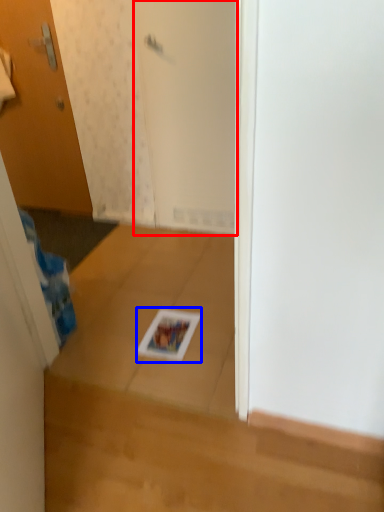
Question: Which object appears farthest to the camera in this image, screen door (highlighted by a red box) or magazine (highlighted by a blue box)?

Choices:
 (A) screen door
 (B) magazine

Answer: (A)